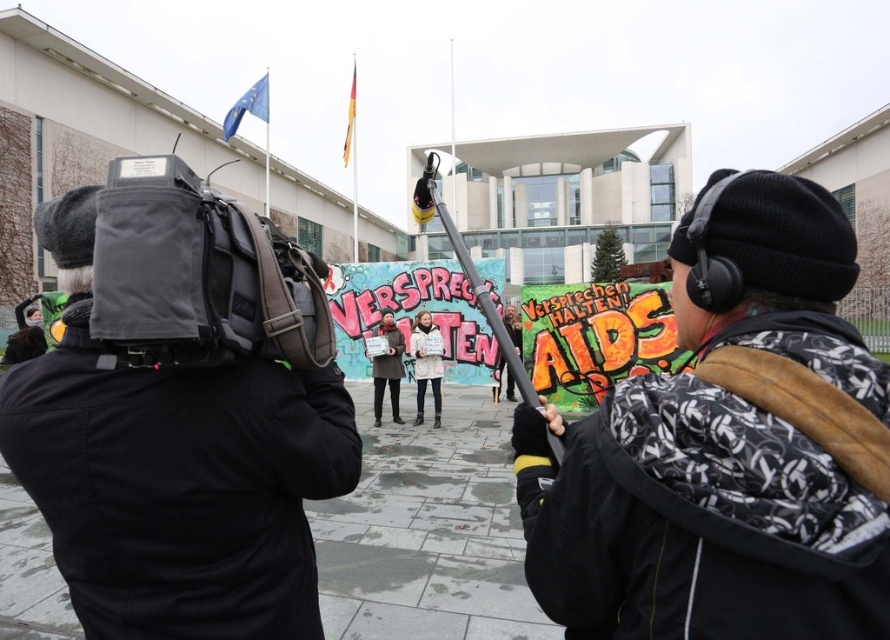
Does black knit cap at upper right come behind matte black jacket at center?

No.

Does point (700, 282) lie in front of point (393, 385)?

Yes.

Image resolution: width=890 pixels, height=640 pixels. What are the coordinates of `black knit cap at upper right` in the screenshot? It's located at (726, 445).

From the picture: Who is higher up, white cotton coat at center or matte black jacket at center?

matte black jacket at center is higher up.

I want to click on white cotton coat at center, so click(x=426, y=364).

Does black fabric camera at left lie behind white cotton coat at center?

No, it is not.

Who is higher up, black fabric camera at left or white cotton coat at center?

Positioned higher is black fabric camera at left.

This screenshot has width=890, height=640. What are the coordinates of `black fabric camera at left` in the screenshot? It's located at (174, 474).